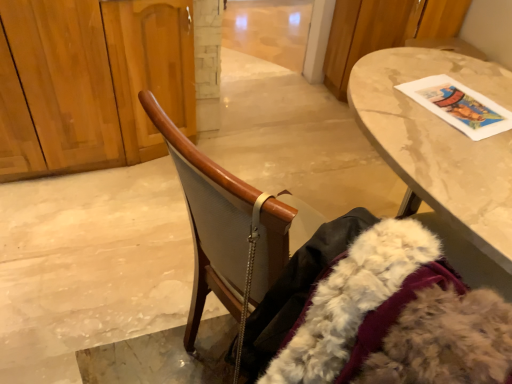
Question: Is marble table at upper right to the left or to the right of wooden chair at center in the image?

Choices:
 (A) right
 (B) left

Answer: (A)

Question: In terms of width, does marble table at upper right look wider or thinner when compared to wooden chair at center?

Choices:
 (A) wide
 (B) thin

Answer: (A)

Question: Estimate the real-world distances between objects in this image. Which object is closer to the white fluffy fur coat at lower right?

Choices:
 (A) wooden dresser at left
 (B) marble table at upper right
 (C) wooden chair at center

Answer: (C)

Question: Which object is positioned farthest from the marble table at upper right?

Choices:
 (A) white fluffy fur coat at lower right
 (B) wooden dresser at left
 (C) wooden chair at center

Answer: (B)